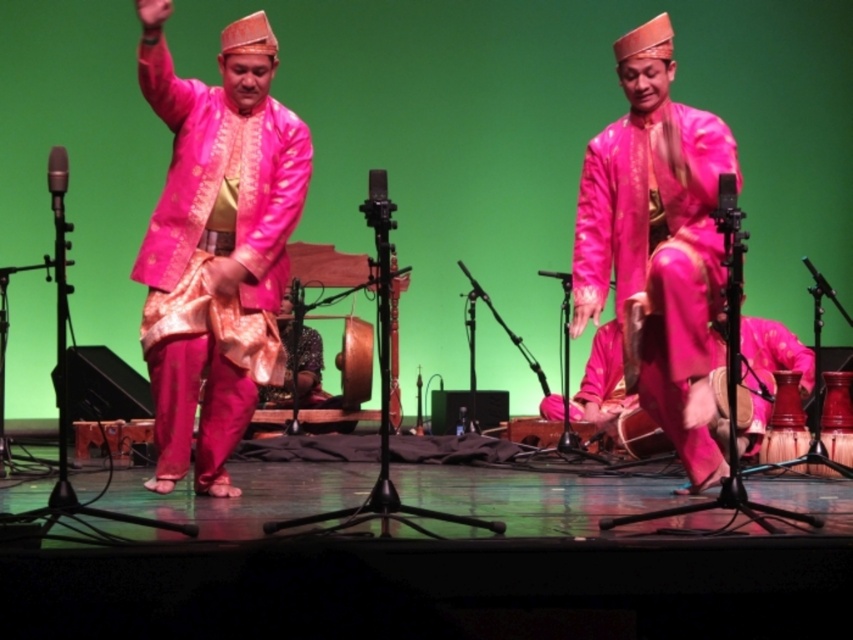
Question: Which of these objects is positioned closest to the silky pink fabric at center?

Choices:
 (A) matte pink silk outfit at center
 (B) matte pink fabric at center

Answer: (A)

Question: From the image, what is the correct spatial relationship of matte pink silk outfit at center in relation to matte pink fabric at center?

Choices:
 (A) above
 (B) below

Answer: (A)

Question: Does matte pink fabric at center have a lesser width compared to silky pink fabric at center?

Choices:
 (A) no
 (B) yes

Answer: (A)

Question: Is matte pink silk outfit at center positioned at the back of matte pink fabric at center?

Choices:
 (A) yes
 (B) no

Answer: (B)

Question: Which of the following is the farthest from the observer?

Choices:
 (A) (268, 401)
 (B) (635, 132)

Answer: (A)

Question: Among these objects, which one is farthest from the camera?

Choices:
 (A) silky pink fabric at center
 (B) matte pink fabric at center

Answer: (A)